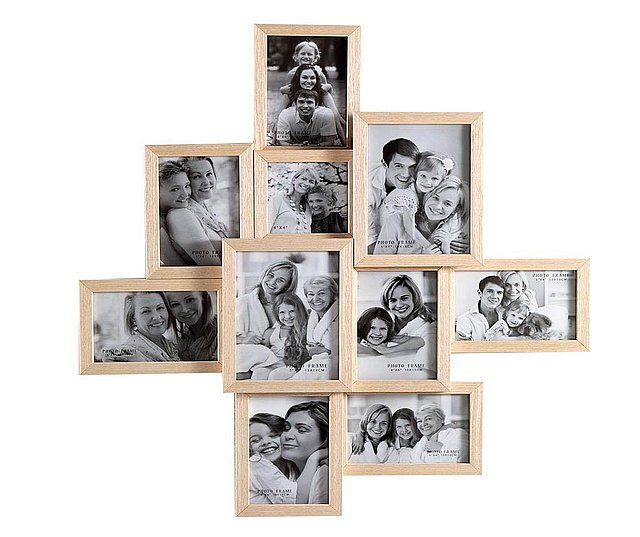
The width and height of the screenshot is (640, 537). What are the coordinates of `picture frames` in the screenshot? It's located at (474, 401), (438, 379), (461, 348), (442, 259), (321, 157), (262, 123), (246, 186), (184, 286), (230, 314), (243, 447).